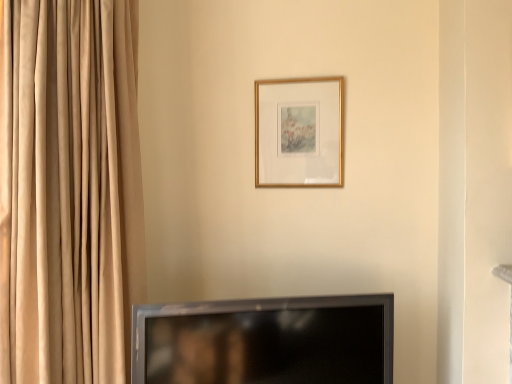
Question: Is point (352, 319) closer or farther from the camera than point (321, 114)?

Choices:
 (A) closer
 (B) farther

Answer: (A)

Question: Considering the positions of black glossy tv at lower center and gold metallic picture frame at upper center in the image, is black glossy tv at lower center wider or thinner than gold metallic picture frame at upper center?

Choices:
 (A) thin
 (B) wide

Answer: (B)

Question: From the image's perspective, is black glossy tv at lower center located above or below gold metallic picture frame at upper center?

Choices:
 (A) above
 (B) below

Answer: (B)

Question: Considering the positions of gold metallic picture frame at upper center and black glossy tv at lower center in the image, is gold metallic picture frame at upper center taller or shorter than black glossy tv at lower center?

Choices:
 (A) short
 (B) tall

Answer: (B)

Question: In the image, is gold metallic picture frame at upper center on the left side or the right side of black glossy tv at lower center?

Choices:
 (A) left
 (B) right

Answer: (B)

Question: Is gold metallic picture frame at upper center situated inside black glossy tv at lower center or outside?

Choices:
 (A) inside
 (B) outside

Answer: (B)

Question: From a real-world perspective, relative to black glossy tv at lower center, is gold metallic picture frame at upper center vertically above or below?

Choices:
 (A) above
 (B) below

Answer: (A)